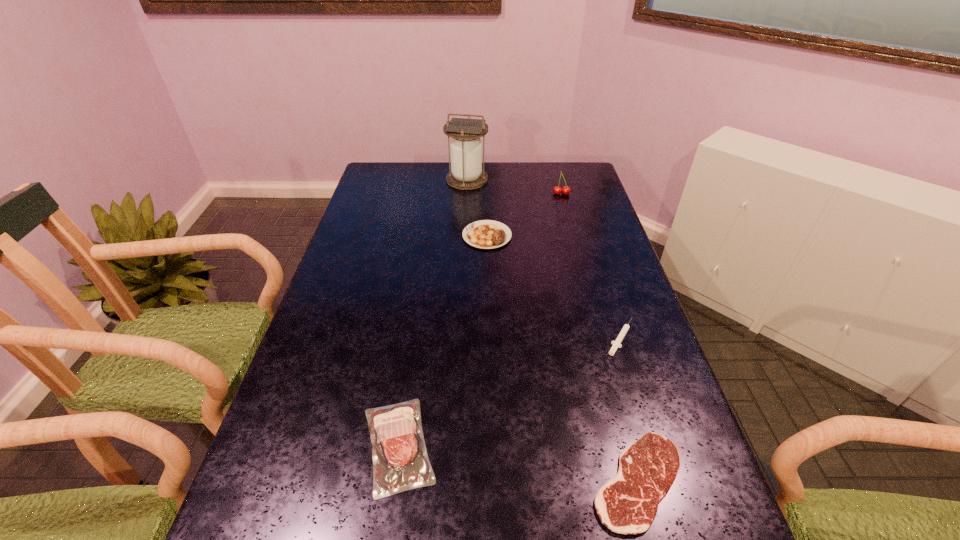
Image resolution: width=960 pixels, height=540 pixels. In order to click on free space between the syringe and the third farthest object in this screenshot , I will do `click(554, 287)`.

Where is `unoccupied position between the leftmost steak and the cherry`? This screenshot has height=540, width=960. unoccupied position between the leftmost steak and the cherry is located at coordinates (480, 320).

The width and height of the screenshot is (960, 540). What are the coordinates of `vacant space that is in between the fourth nearest object and the lantern` in the screenshot? It's located at (477, 208).

The width and height of the screenshot is (960, 540). What are the coordinates of `empty space between the fifth shortest object and the shortest steak` in the screenshot? It's located at (600, 338).

Where is `vacant area that lies between the second tallest object and the rightmost steak`? This screenshot has height=540, width=960. vacant area that lies between the second tallest object and the rightmost steak is located at coordinates (600, 338).

Find the location of `vacant space that's between the shortest steak and the second tallest steak`. vacant space that's between the shortest steak and the second tallest steak is located at coordinates (518, 463).

Identify the location of blank region between the cherry and the lantern. This screenshot has width=960, height=540. (515, 187).

Identify the location of free space that is in between the shortest steak and the farthest object. (553, 330).

This screenshot has height=540, width=960. What are the coordinates of `free area in between the farthest steak and the farthest object` in the screenshot? It's located at (477, 208).

You are a GUI agent. You are given a task and a screenshot of the screen. Output one action in this format:
    pyautogui.click(x=<x>, y=<y>)
    Task: Click on the object that is the fifth closest to the shortest object
    
    Given the screenshot: What is the action you would take?
    pyautogui.click(x=466, y=173)